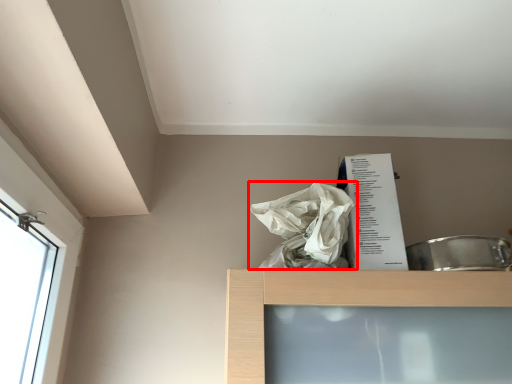
Question: In this image, where is plastic bag (annotated by the red box) located relative to paperback book?

Choices:
 (A) left
 (B) right

Answer: (A)